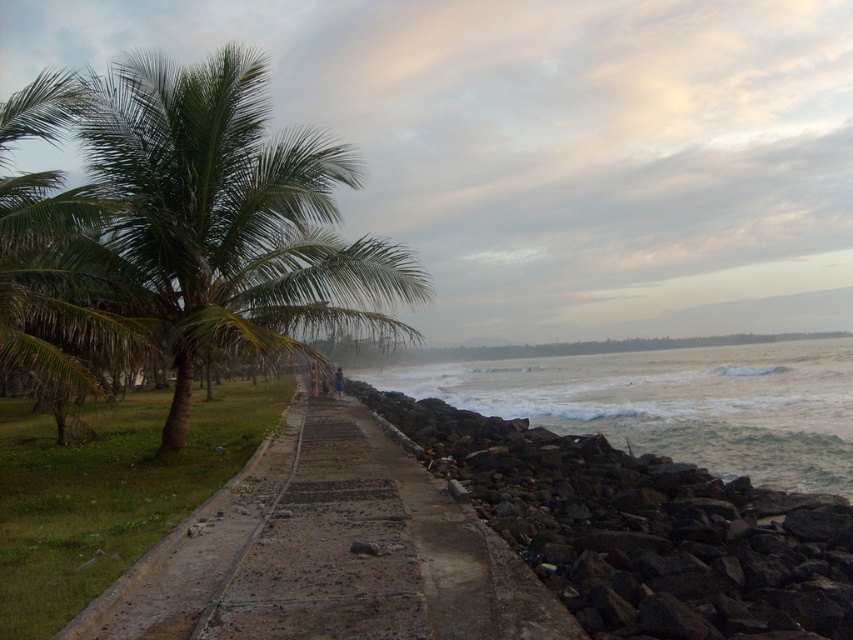
Who is shorter, concrete at center or dark gray rocky wall at lower right?

concrete at center

Which is in front, point (341, 448) or point (675, 579)?

Point (675, 579)

The width and height of the screenshot is (853, 640). What do you see at coordinates (328, 552) in the screenshot?
I see `concrete at center` at bounding box center [328, 552].

I want to click on concrete at center, so click(328, 552).

Can you confirm if dark gray rocky wall at lower right is taller than white frothy water at right?

Incorrect, dark gray rocky wall at lower right's height is not larger of white frothy water at right's.

Is dark gray rocky wall at lower right thinner than white frothy water at right?

Correct, dark gray rocky wall at lower right's width is less than white frothy water at right's.

Which is behind, point (654, 577) or point (543, 419)?

The point (543, 419) is more distant.

Locate an element on the screen. This screenshot has width=853, height=640. dark gray rocky wall at lower right is located at coordinates (641, 529).

Who is more forward, [158,326] or [793,419]?

Point [158,326]

Image resolution: width=853 pixels, height=640 pixels. I want to click on green leafy palm tree at left, so click(x=222, y=221).